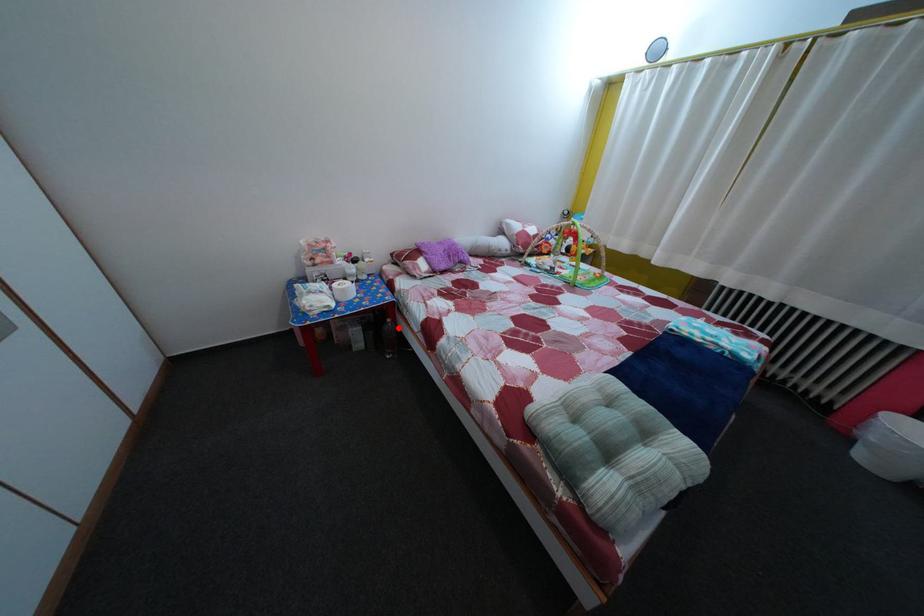
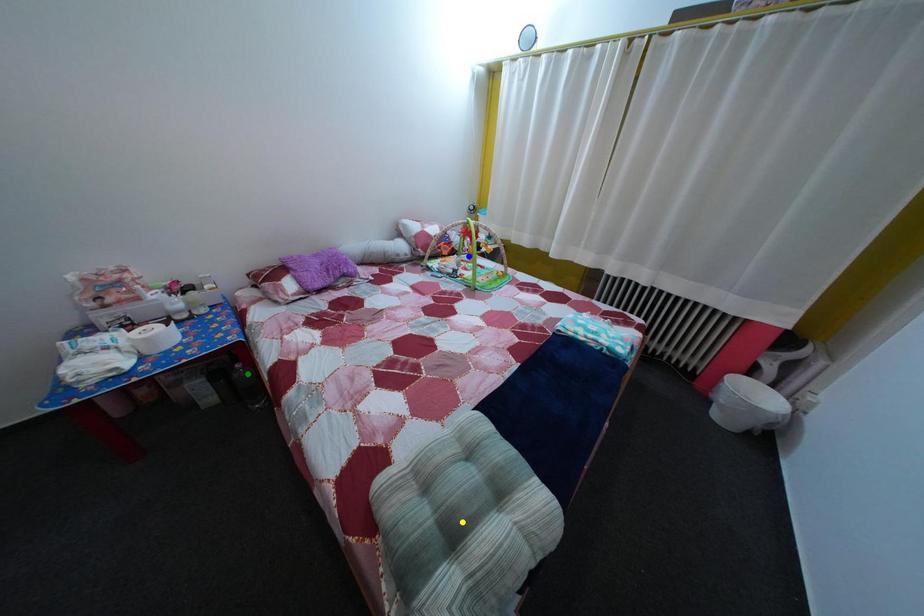
Question: I am providing you with two images of the same scene from different viewpoints. A red point is marked on the first image. You are given multiple points on the second image. Which point in image 2 represents the same 3d spot as the red point in image 1?

Choices:
 (A) blue point
 (B) green point
 (C) yellow point

Answer: (B)